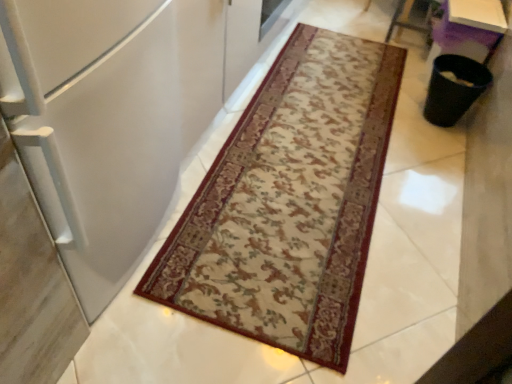
Find the location of a particular element. The width and height of the screenshot is (512, 384). free point below beige carpet with floral pattern at center (from a real-world perspective) is located at coordinates (251, 270).